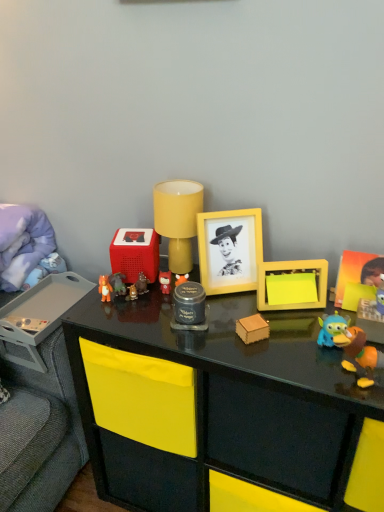
The width and height of the screenshot is (384, 512). In order to click on vacant space in front of blue rubber duck at right, acting as the 2th toy starting from the right in this screenshot , I will do `click(339, 381)`.